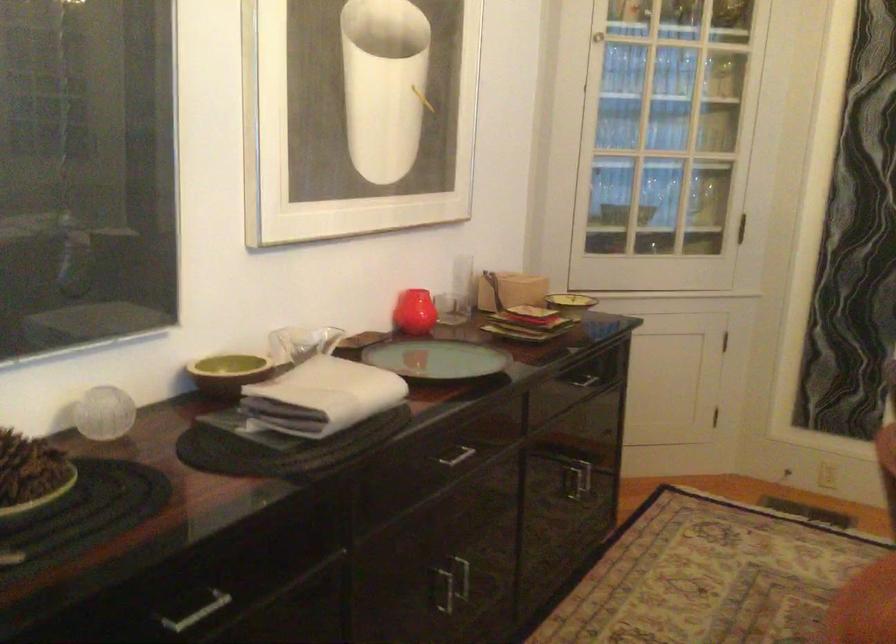
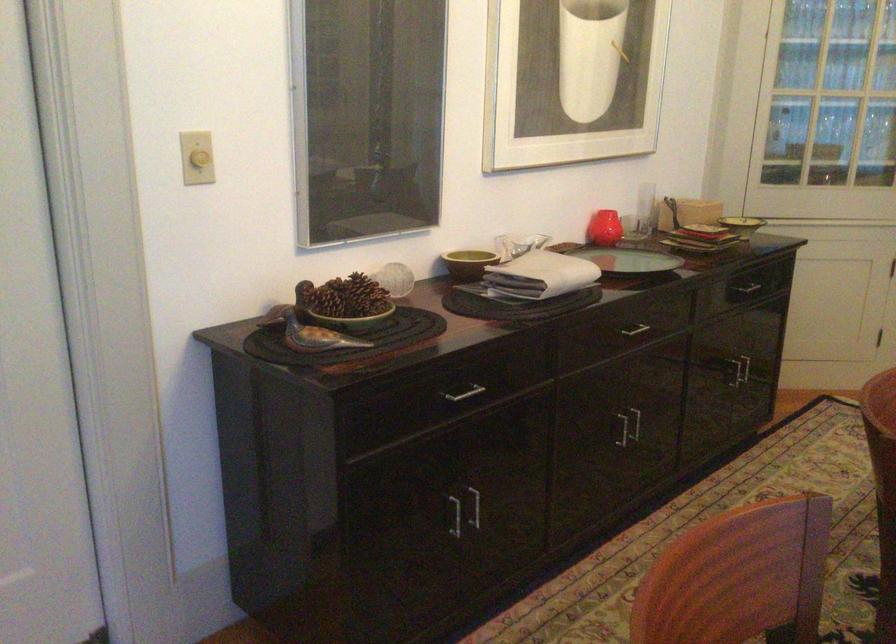
In the second image, find the point that corresponds to the point at 564,306 in the first image.

(742, 225)